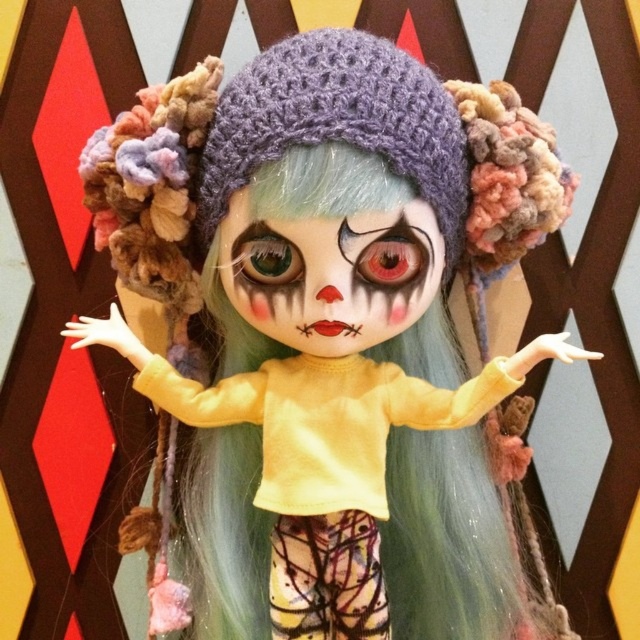
Question: Which point appears closest to the camera in this image?

Choices:
 (A) (204, 250)
 (B) (298, 340)

Answer: (B)

Question: Can you confirm if purple knitted hat at center is bigger than matte painted face at center?

Choices:
 (A) yes
 (B) no

Answer: (A)

Question: Does purple knitted hat at center come in front of matte painted face at center?

Choices:
 (A) yes
 (B) no

Answer: (A)

Question: Which point is farther to the camera?

Choices:
 (A) (304, 237)
 (B) (241, 134)

Answer: (B)

Question: Which point appears closest to the camera in this image?

Choices:
 (A) (332, 65)
 (B) (332, 218)

Answer: (B)

Question: Where is purple knitted hat at center located in relation to matte painted face at center in the image?

Choices:
 (A) below
 (B) above

Answer: (B)